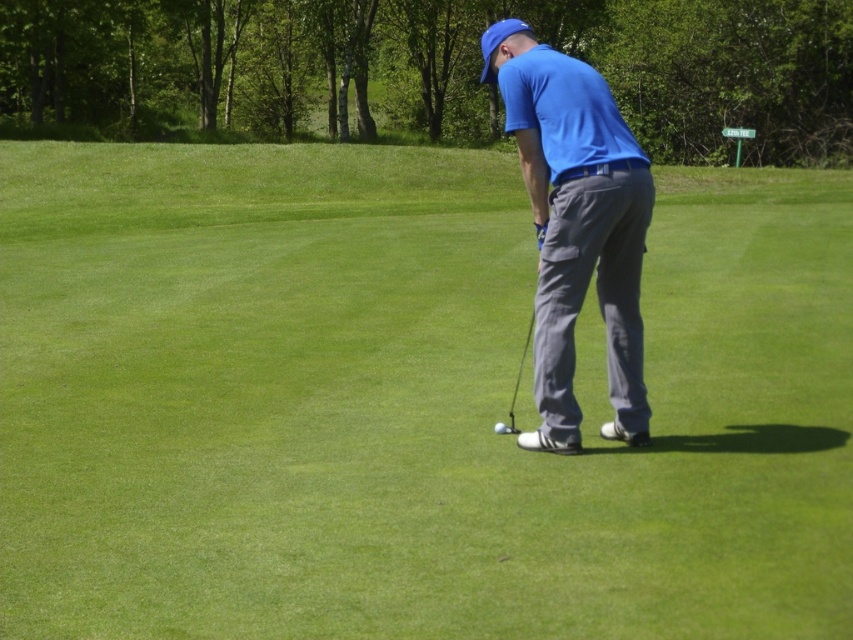
Looking at this image, does matte blue polo shirt at center have a lesser height compared to white matte golf ball at center?

Incorrect, matte blue polo shirt at center's height does not fall short of white matte golf ball at center's.

Is matte blue polo shirt at center to the right of white matte golf ball at center from the viewer's perspective?

Yes, matte blue polo shirt at center is to the right of white matte golf ball at center.

Is point (527, 106) positioned behind point (506, 428)?

No, (527, 106) is in front of (506, 428).

You are a GUI agent. You are given a task and a screenshot of the screen. Output one action in this format:
    pyautogui.click(x=<x>, y=<y>)
    Task: Click on the matte blue polo shirt at center
    
    Given the screenshot: What is the action you would take?
    pyautogui.click(x=564, y=109)

Which is more to the left, metallic silver golf club at center or white matte golf ball at center?

white matte golf ball at center

Who is higher up, metallic silver golf club at center or white matte golf ball at center?

metallic silver golf club at center

The image size is (853, 640). In order to click on metallic silver golf club at center in this screenshot , I will do `click(520, 374)`.

Does blue cotton shirt at center come behind white matte golf ball at center?

No, it is in front of white matte golf ball at center.

Does blue cotton shirt at center have a greater width compared to white matte golf ball at center?

Correct, the width of blue cotton shirt at center exceeds that of white matte golf ball at center.

Identify the location of blue cotton shirt at center. (576, 227).

Identify the location of blue cotton shirt at center. The image size is (853, 640). (576, 227).